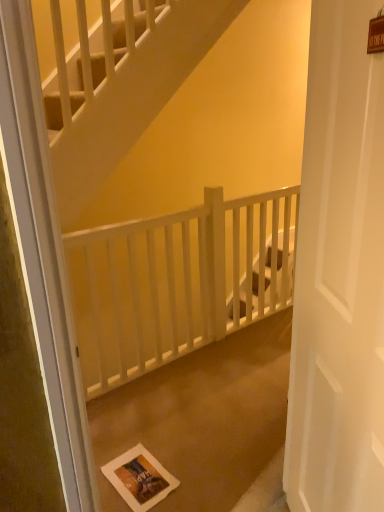
Question: Is white matte door at center bigger than white wooden balustrade at center?

Choices:
 (A) no
 (B) yes

Answer: (A)

Question: Can you confirm if white matte door at center is thinner than white wooden balustrade at center?

Choices:
 (A) no
 (B) yes

Answer: (B)

Question: Are white matte door at center and white wooden balustrade at center far apart?

Choices:
 (A) yes
 (B) no

Answer: (A)

Question: Does white matte door at center turn towards white wooden balustrade at center?

Choices:
 (A) no
 (B) yes

Answer: (A)

Question: Does white matte door at center appear on the right side of white wooden balustrade at center?

Choices:
 (A) no
 (B) yes

Answer: (B)

Question: From a real-world perspective, is white paper bag at center positioned above or below white wooden balustrade at center?

Choices:
 (A) below
 (B) above

Answer: (A)

Question: Is point pos(114,444) closer or farther from the camera than point pos(221,306)?

Choices:
 (A) closer
 (B) farther

Answer: (A)

Question: Looking at their shapes, would you say white paper bag at center is wider or thinner than white wooden balustrade at center?

Choices:
 (A) wide
 (B) thin

Answer: (A)

Question: Is white paper bag at center bigger or smaller than white wooden balustrade at center?

Choices:
 (A) big
 (B) small

Answer: (B)

Question: Would you say white matte door at center is to the left or to the right of white wooden balustrade at center in the picture?

Choices:
 (A) right
 (B) left

Answer: (A)

Question: Considering the positions of white matte door at center and white wooden balustrade at center in the image, is white matte door at center wider or thinner than white wooden balustrade at center?

Choices:
 (A) wide
 (B) thin

Answer: (B)

Question: From a real-world perspective, is white matte door at center positioned above or below white wooden balustrade at center?

Choices:
 (A) above
 (B) below

Answer: (A)

Question: From their relative heights in the image, would you say white matte door at center is taller or shorter than white wooden balustrade at center?

Choices:
 (A) tall
 (B) short

Answer: (A)

Question: Do you think white matte door at center is within white paper postcard at lower center, or outside of it?

Choices:
 (A) inside
 (B) outside

Answer: (B)

Question: From the image's perspective, is white matte door at center located above or below white paper postcard at lower center?

Choices:
 (A) above
 (B) below

Answer: (A)